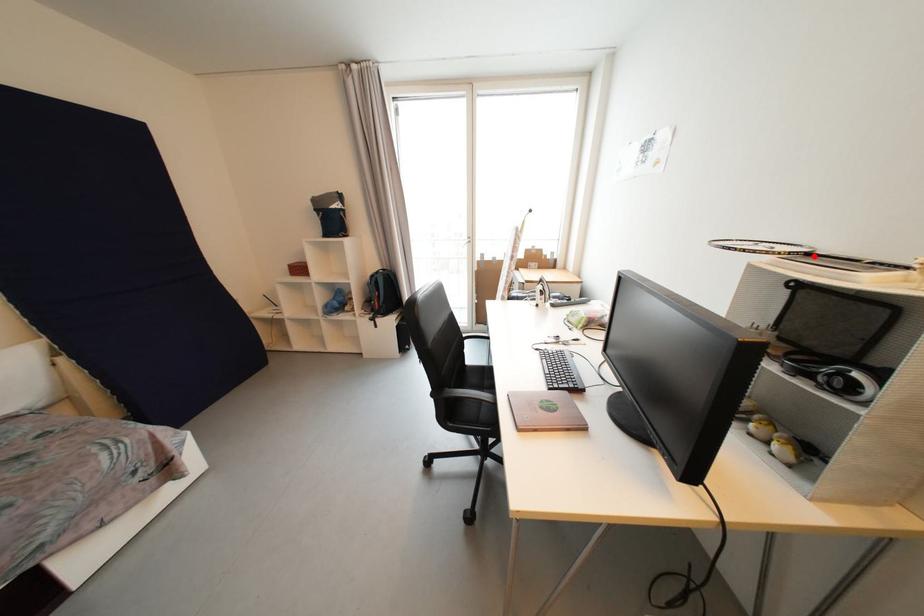
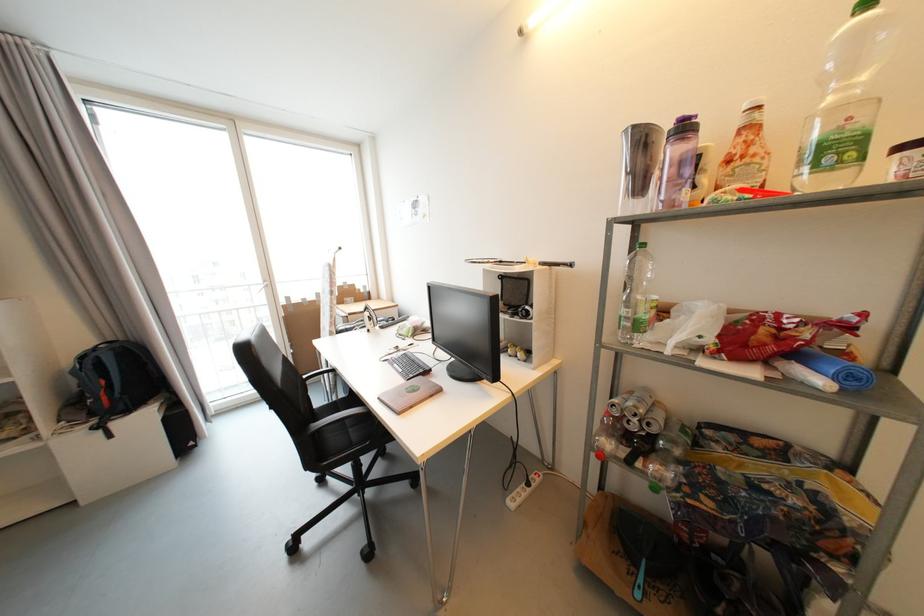
Where in the second image is the point corresponding to the highlighted location from the first image?

(505, 264)